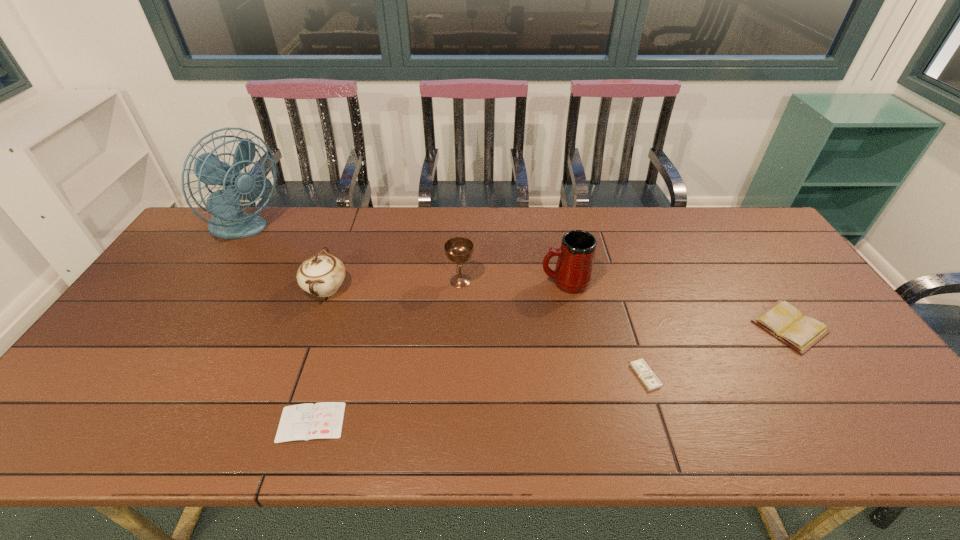
Find the location of a particular element. the nearer diary is located at coordinates (322, 420).

What are the coordinates of `the left diary` in the screenshot? It's located at (322, 420).

Identify the location of vacant region located 0.300m in front of the fan to blow air. This screenshot has height=540, width=960. (371, 232).

In order to click on vacant space located 0.350m on the side of the third object from right to left with the handle in this screenshot , I will do `click(423, 282)`.

You are a GUI agent. You are given a task and a screenshot of the screen. Output one action in this format:
    pyautogui.click(x=<x>, y=<y>)
    Task: Click on the free space located 0.280m on the side of the third object from right to left with the handle
    
    Given the screenshot: What is the action you would take?
    pyautogui.click(x=447, y=282)

What are the coordinates of `vacant area located on the side of the third object from right to left with the handle` in the screenshot? It's located at (504, 282).

Where is `free space located on the left of the fourth object from right to left`? free space located on the left of the fourth object from right to left is located at coordinates (426, 281).

This screenshot has height=540, width=960. What are the coordinates of `vacant region located 0.110m on the front of the chinaware` in the screenshot? It's located at [x=306, y=342].

You are a GUI agent. You are given a task and a screenshot of the screen. Output one action in this format:
    pyautogui.click(x=<x>, y=<y>)
    Task: Click on the free space located 0.190m on the front of the rightmost object
    Image resolution: width=960 pixels, height=540 pixels.
    Given the screenshot: What is the action you would take?
    pyautogui.click(x=855, y=424)

In order to click on free space located on the right of the sixth farthest object in this screenshot , I will do (x=703, y=376).